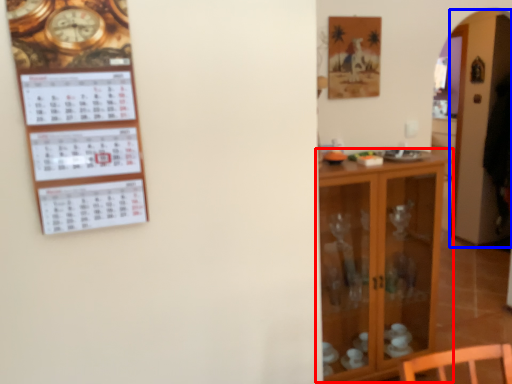
Question: Which object appears farthest to the camera in this image, shelf (highlighted by a red box) or glass door (highlighted by a blue box)?

Choices:
 (A) shelf
 (B) glass door

Answer: (B)